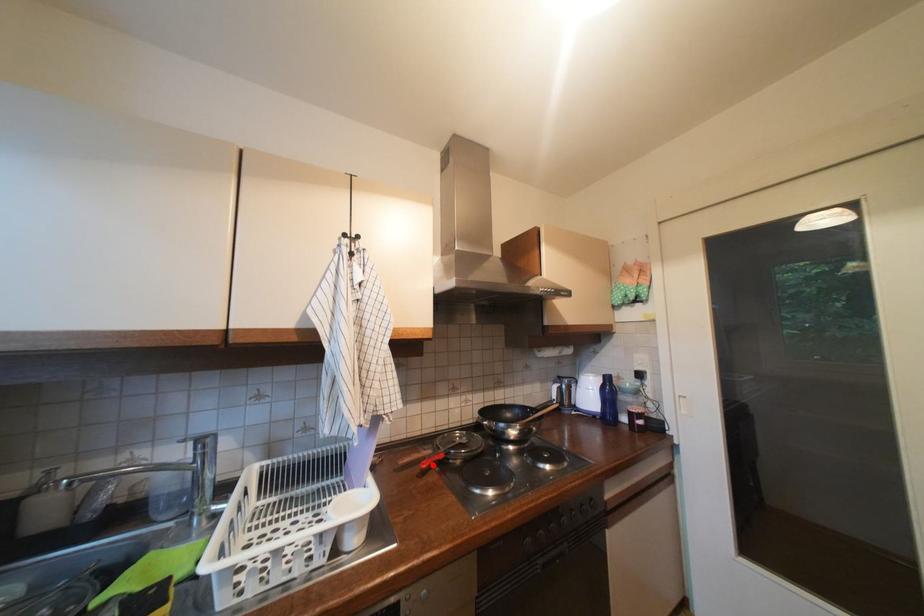
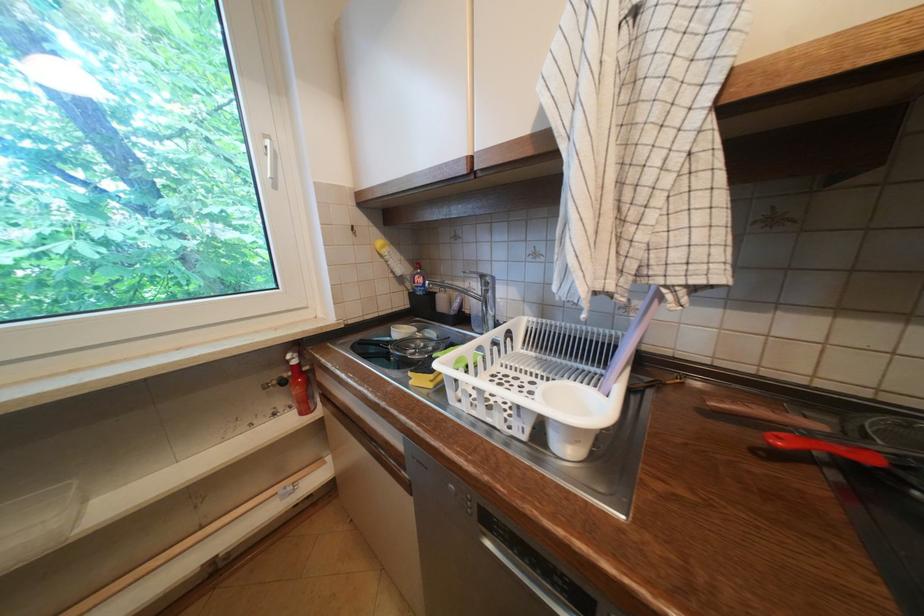
Find the pixel in the second image that matches the highlighted location in the first image.

(788, 440)